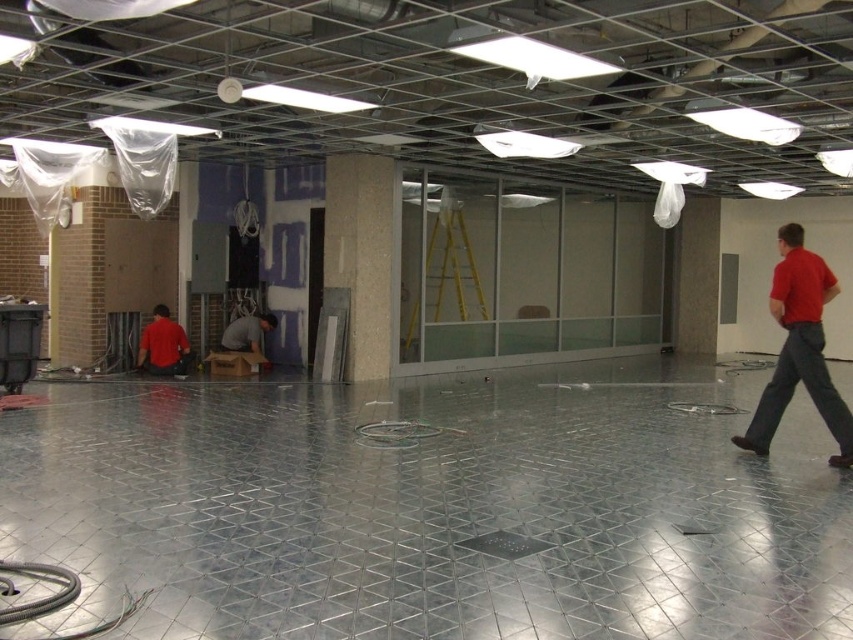
Question: From the image, what is the correct spatial relationship of red cotton shirt at right in relation to matte red shirt at left?

Choices:
 (A) left
 (B) right

Answer: (B)

Question: Estimate the real-world distances between objects in this image. Which object is closer to the gray fabric shirt at center?

Choices:
 (A) matte red shirt at left
 (B) red cotton shirt at right

Answer: (A)

Question: Which point appears farthest from the camera in this image?

Choices:
 (A) (x=222, y=333)
 (B) (x=793, y=328)
 (C) (x=175, y=340)

Answer: (A)

Question: Is red cotton shirt at right to the left of gray fabric shirt at center from the viewer's perspective?

Choices:
 (A) no
 (B) yes

Answer: (A)

Question: Which point appears farthest from the camera in this image?

Choices:
 (A) (165, 312)
 (B) (271, 317)
 (C) (792, 330)

Answer: (B)

Question: Can you confirm if matte red shirt at left is smaller than gray fabric shirt at center?

Choices:
 (A) yes
 (B) no

Answer: (A)